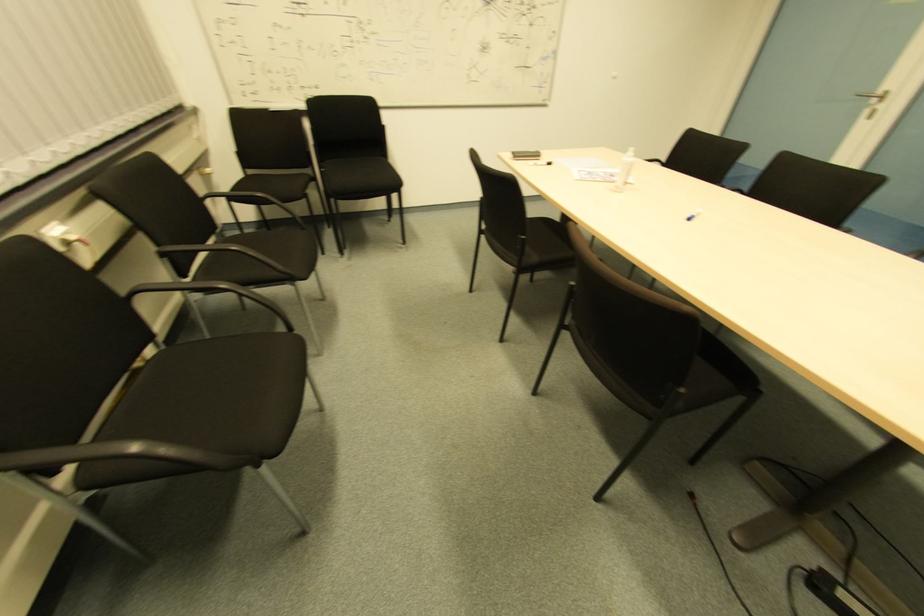
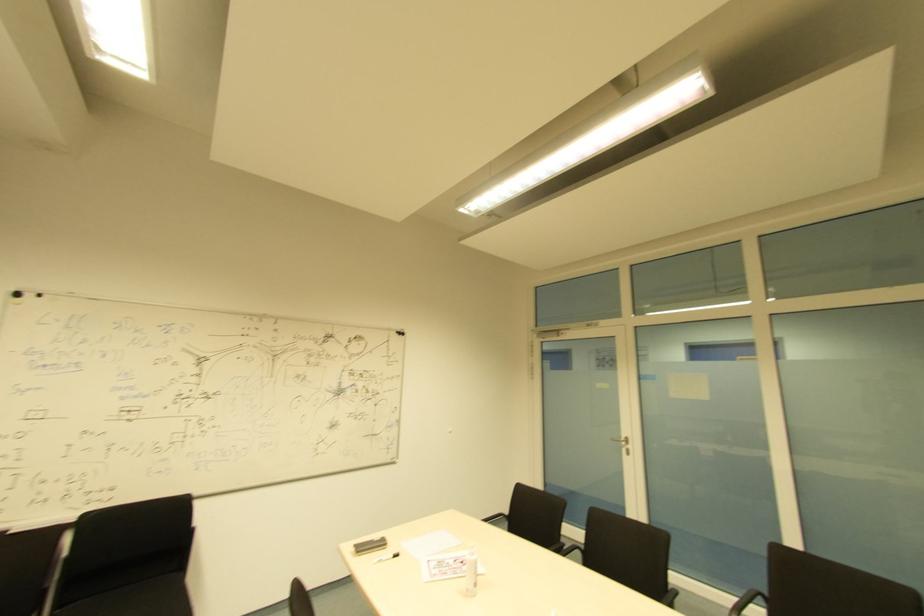
Find the pixel in the second image that matches (x=549, y=163) in the first image.

(394, 554)